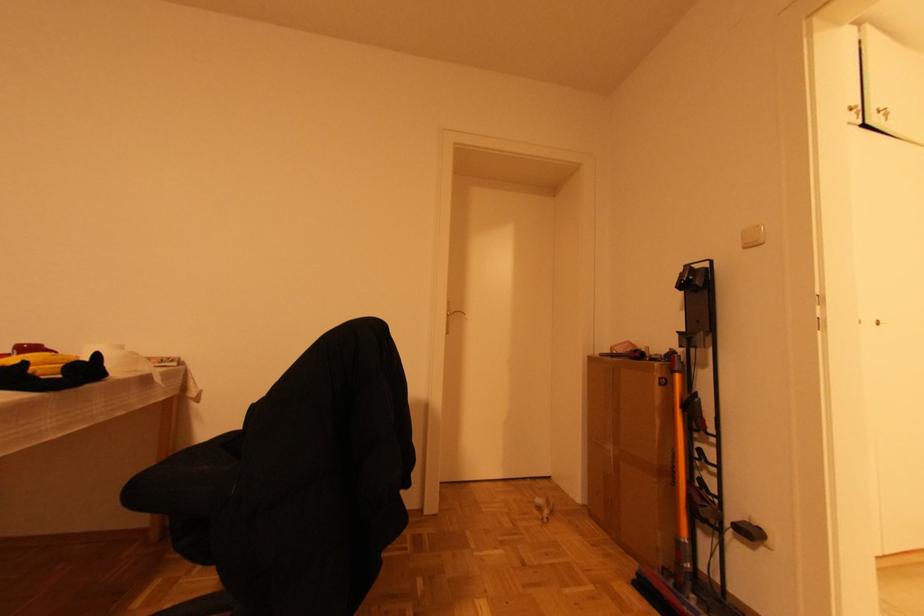
Where would you grip the vacuum cleaner handle? Please return your answer as a coordinate pair (x, y).

(704, 453)